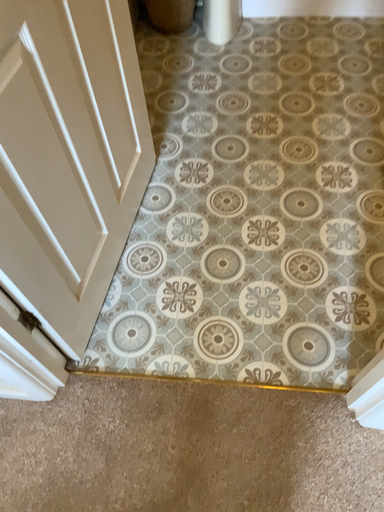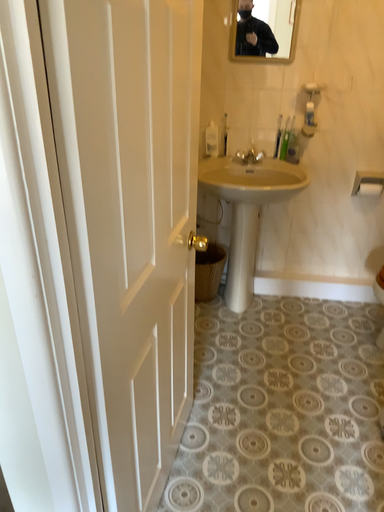
Question: How did the camera likely rotate when shooting the video?

Choices:
 (A) rotated downward
 (B) rotated upward

Answer: (B)